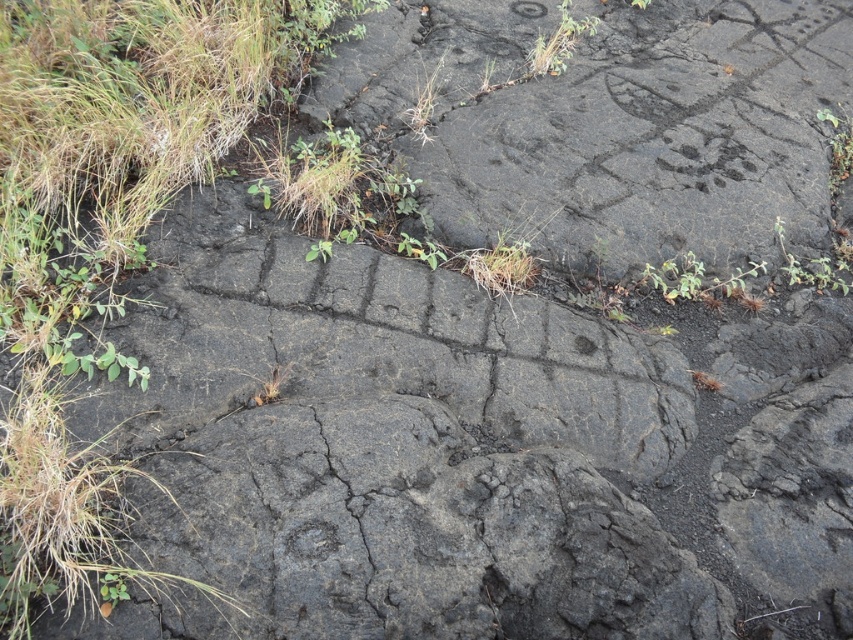
You are a botanist examining the volcanic rock surface. You notice the green leafy plant at upper right and the green grass at center. Which of these two plants has a wider spread?

The green leafy plant at upper right has a wider spread than the green grass at center.

You are a geologist examining the volcanic rock surface. You notice two points on the rock surface at coordinates point (567, 45) and point (824, 113). Which point is closer to your viewpoint?

Point (567, 45) is further to the viewer than point (824, 113), so the point closer to your viewpoint is point (824, 113).